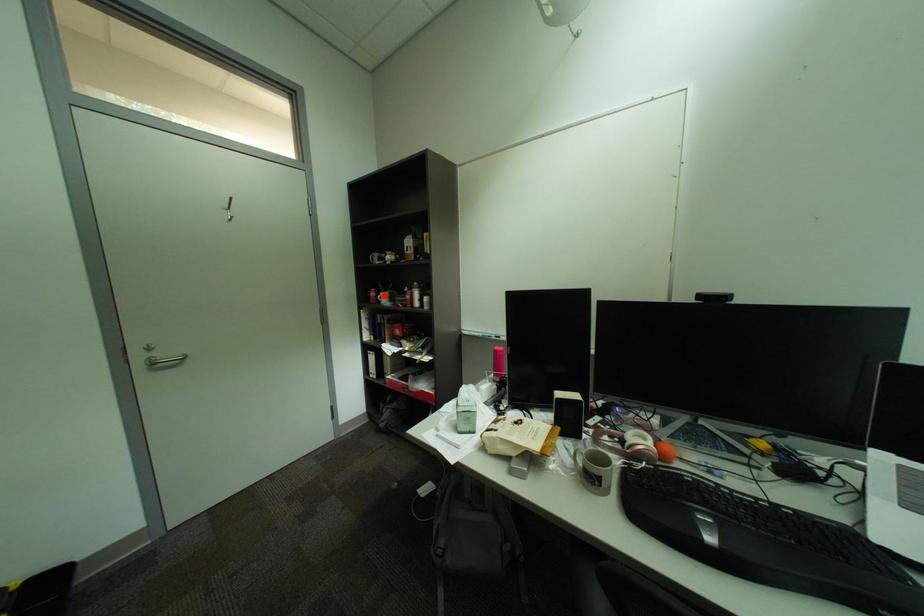
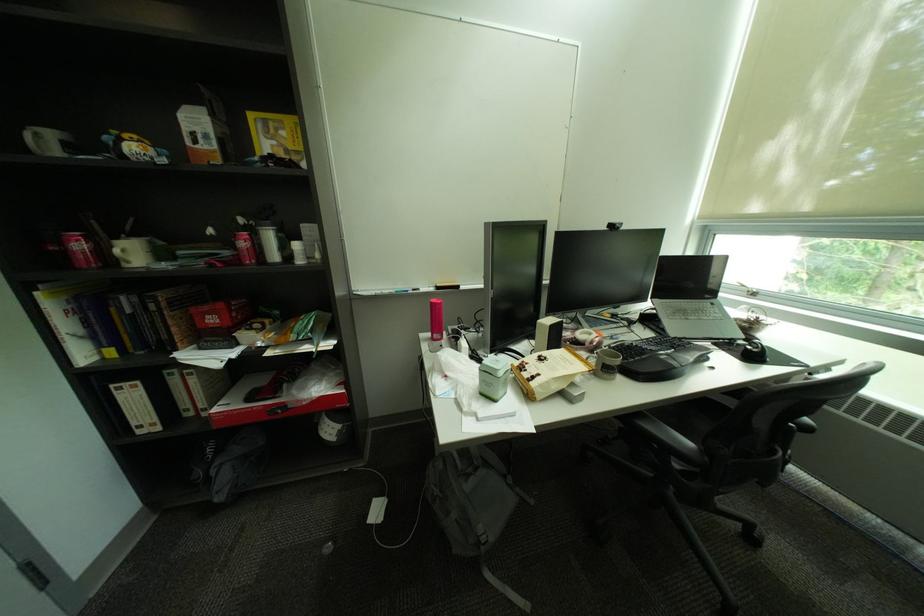
Find the pixel in the second image that matches the highlighted location in the first image.

(91, 246)